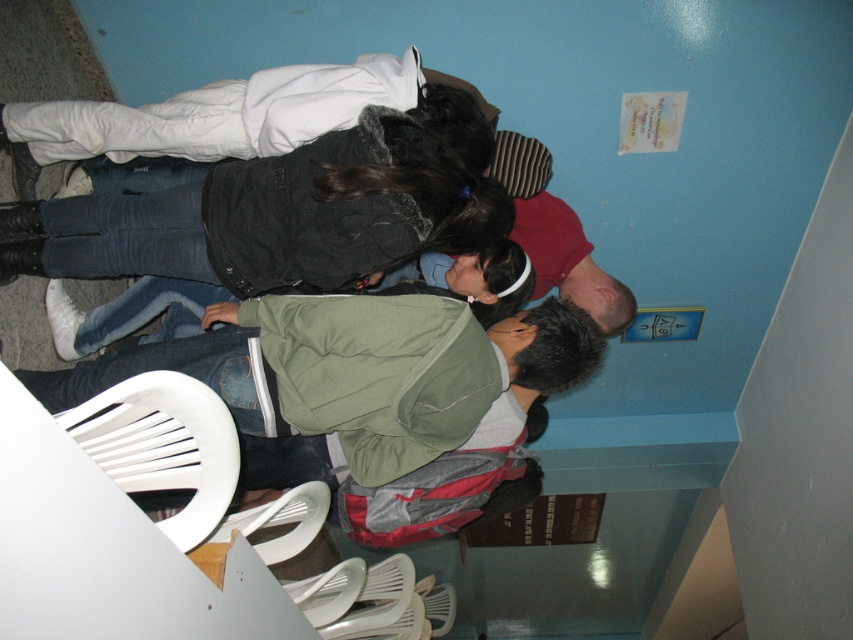
Question: Which point is closer to the camera?

Choices:
 (A) 192,262
 (B) 59,419

Answer: (B)

Question: Can you confirm if denim jacket at center is positioned below white plastic chair at lower left?

Choices:
 (A) yes
 (B) no

Answer: (B)

Question: From the image, what is the correct spatial relationship of denim jacket at center in relation to white plastic chair at lower left?

Choices:
 (A) right
 (B) left

Answer: (B)

Question: Is denim jacket at center closer to camera compared to white plastic chair at lower left?

Choices:
 (A) yes
 (B) no

Answer: (B)

Question: Among these objects, which one is farthest from the camera?

Choices:
 (A) denim jacket at center
 (B) white plastic chair at lower left

Answer: (A)